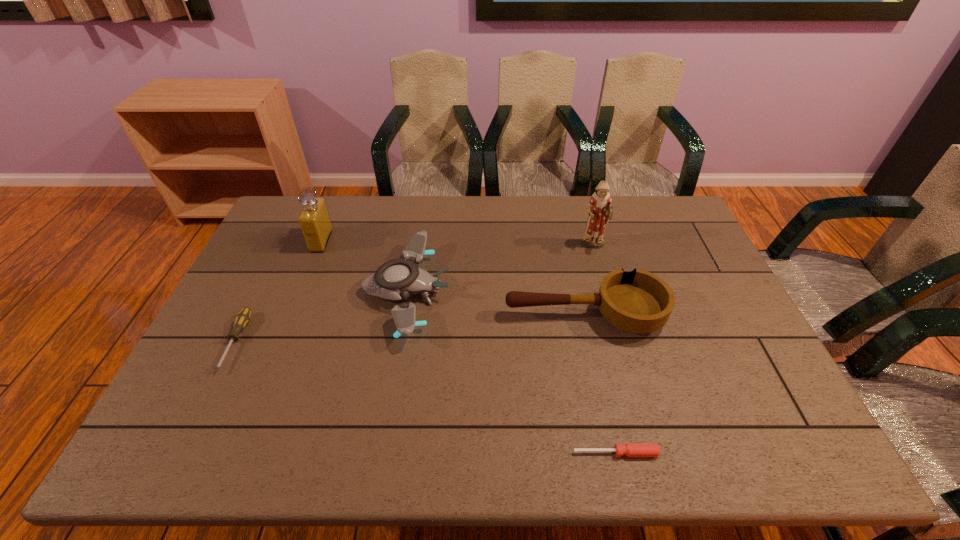
Locate an element on the screen. The height and width of the screenshot is (540, 960). free region at the far edge of the desktop is located at coordinates (515, 207).

This screenshot has width=960, height=540. In order to click on free space at the left edge of the desktop in this screenshot , I will do click(x=262, y=352).

Where is `vacant space at the right edge of the desktop`? This screenshot has width=960, height=540. vacant space at the right edge of the desktop is located at coordinates (674, 236).

The width and height of the screenshot is (960, 540). I want to click on vacant space at the far right corner of the desktop, so click(x=651, y=210).

Locate an element on the screen. vacant space in between the tallest object and the second tallest object is located at coordinates (457, 244).

Find the location of `free space between the second shortest object and the shorter screwdriver`. free space between the second shortest object and the shorter screwdriver is located at coordinates pyautogui.click(x=426, y=397).

Image resolution: width=960 pixels, height=540 pixels. I want to click on free space between the fifth tallest object and the second object from left to right, so click(278, 292).

The width and height of the screenshot is (960, 540). Find the location of `free space between the tallest object and the shorter screwdriver`. free space between the tallest object and the shorter screwdriver is located at coordinates (605, 349).

You are a GUI agent. You are given a task and a screenshot of the screen. Output one action in this format:
    pyautogui.click(x=<x>, y=<y>)
    Task: Click on the vacant area that lies between the nearest object and the fourth object from right to left
    This screenshot has width=960, height=540.
    Given the screenshot: What is the action you would take?
    pyautogui.click(x=512, y=372)

This screenshot has width=960, height=540. I want to click on vacant space in between the third object from left to right and the farther screwdriver, so click(322, 317).